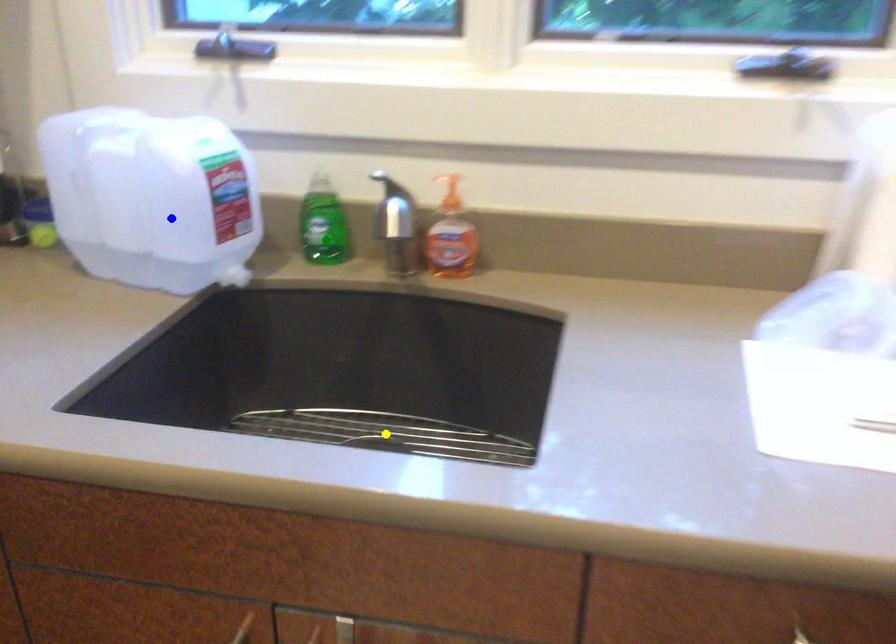
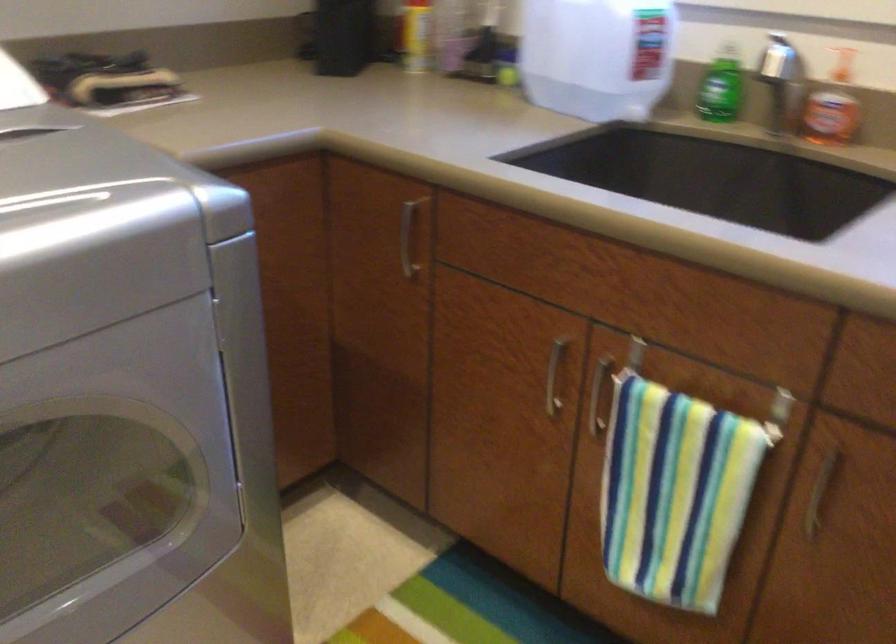
I am providing you with two images of the same scene from different viewpoints. Three points are marked in image1. Which point corresponds to a part or object that is occluded in image2?In image1, three points are marked. Which of them correspond to a part or object that is occluded in image2?Among the three points shown in image1, which one corresponds to a part or object that is no longer visible due to occlusion in image2?

yellow point